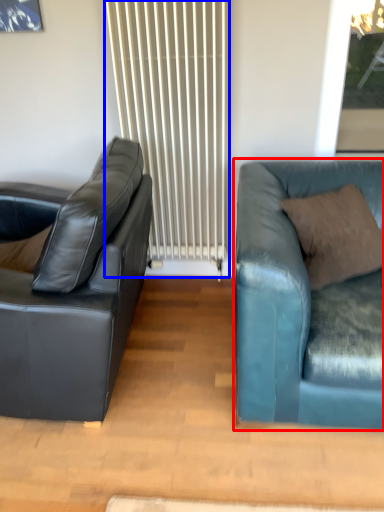
Question: Among these objects, which one is farthest to the camera, studio couch (highlighted by a red box) or radiator (highlighted by a blue box)?

Choices:
 (A) studio couch
 (B) radiator

Answer: (B)